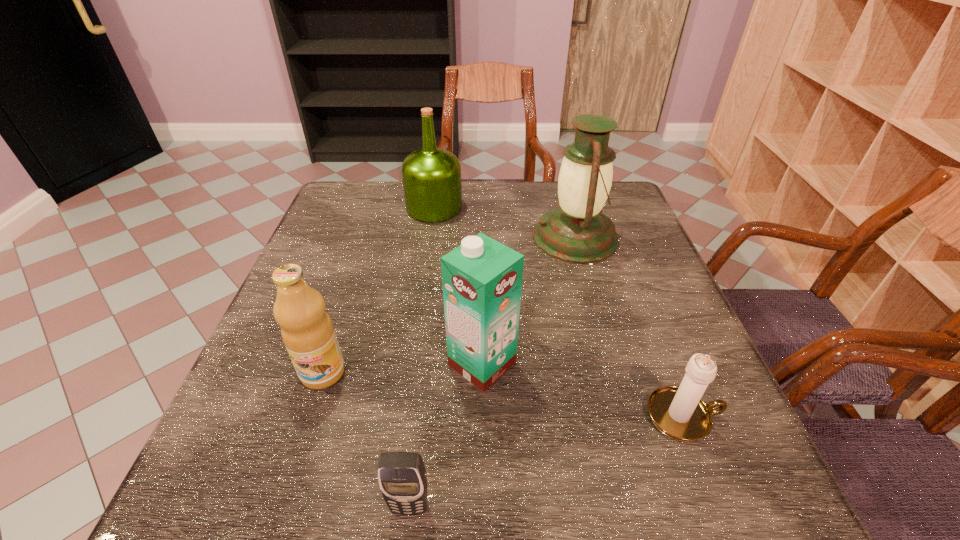
You are a GUI agent. You are given a task and a screenshot of the screen. Output one action in this format:
    pyautogui.click(x=<x>, y=<y>)
    Task: Click on the lantern
    
    Given the screenshot: What is the action you would take?
    [576, 231]

Locate an element on the screen. The image size is (960, 540). the right olive oil is located at coordinates (431, 176).

I want to click on carton, so click(x=482, y=279).

This screenshot has height=540, width=960. I want to click on the leftmost object, so click(x=307, y=331).

Image resolution: width=960 pixels, height=540 pixels. I want to click on the nearer olive oil, so click(307, 331).

The height and width of the screenshot is (540, 960). In order to click on candle holder in this screenshot , I will do `click(679, 413)`.

Find the location of a particular element. This screenshot has width=960, height=540. cellular telephone is located at coordinates (402, 478).

The width and height of the screenshot is (960, 540). I want to click on vacant space located 0.330m with the light compartment facing forward on the lantern, so click(x=407, y=237).

Image resolution: width=960 pixels, height=540 pixels. What are the coordinates of `blank space located 0.170m with the light compartment facing forward on the lantern` in the screenshot? It's located at (468, 237).

I want to click on free space located with the light compartment facing forward on the lantern, so click(475, 237).